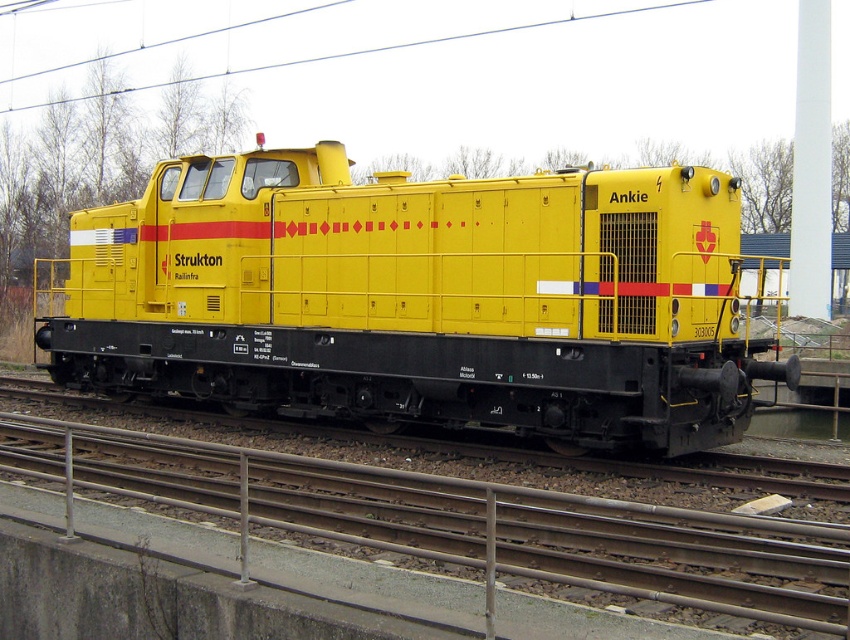
Question: Which of the following is the farthest from the observer?

Choices:
 (A) (72, 97)
 (B) (231, 305)
 (C) (105, 483)

Answer: (A)

Question: Does yellow matte train at center appear on the right side of metallic wire at upper center?

Choices:
 (A) no
 (B) yes

Answer: (B)

Question: Does metal at center have a lesser width compared to metallic wire at upper center?

Choices:
 (A) yes
 (B) no

Answer: (A)

Question: Does yellow matte train at center come in front of metal at center?

Choices:
 (A) no
 (B) yes

Answer: (A)

Question: Which point is closer to the camera?

Choices:
 (A) (582, 20)
 (B) (463, 532)

Answer: (B)

Question: Among these objects, which one is nearest to the camera?

Choices:
 (A) yellow matte train at center
 (B) metallic wire at upper center

Answer: (A)